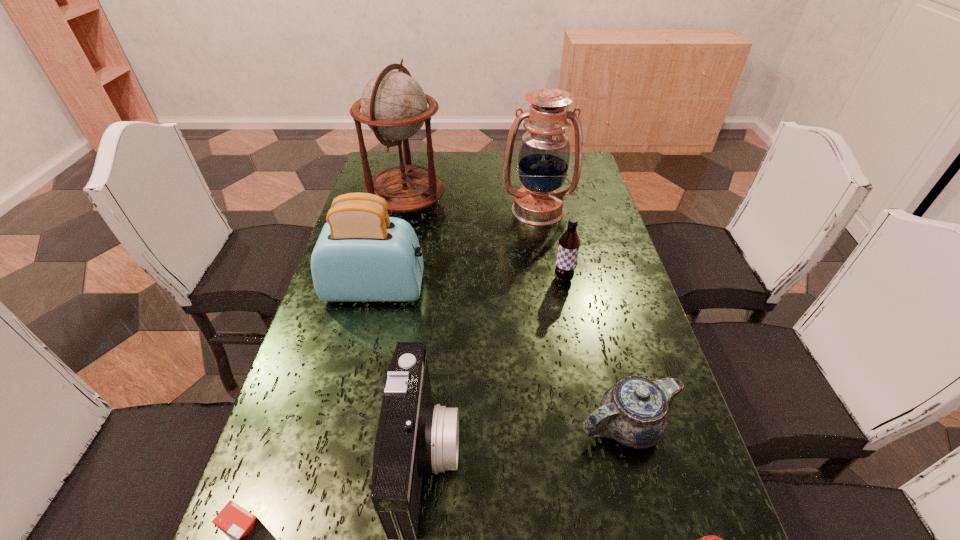
The height and width of the screenshot is (540, 960). Identify the location of vacant area that lies between the toaster and the chinaware. (501, 357).

At what (x,y) coordinates should I click in order to perform the action: click on free space that is in between the root beer and the toaster. Please return your answer as a coordinate pair (x, y). The width and height of the screenshot is (960, 540). Looking at the image, I should click on (469, 285).

Locate an element on the screen. This screenshot has height=540, width=960. free space between the chinaware and the oil lamp is located at coordinates (582, 318).

Image resolution: width=960 pixels, height=540 pixels. Find the location of `vacant area that lies between the chinaware and the root beer`. vacant area that lies between the chinaware and the root beer is located at coordinates (594, 353).

Identify the location of the closest object to the camcorder. (250, 539).

Locate which object is the third closest to the second tallest object. Please provide its 2D coordinates. Your answer should be formatted as a tuple, i.e. [(x, y)], where the tuple contains the x and y coordinates of a point satisfying the conditions above.

[(362, 255)]

Where is `free space that satisfies the following two spatial constraints: 1. on the surface of the globe; 2. on the right side of the root beer`? The image size is (960, 540). free space that satisfies the following two spatial constraints: 1. on the surface of the globe; 2. on the right side of the root beer is located at coordinates (391, 280).

Locate an element on the screen. This screenshot has height=540, width=960. free space that satisfies the following two spatial constraints: 1. on the surface of the root beer; 2. on the left side of the globe is located at coordinates (391, 280).

Locate an element on the screen. The height and width of the screenshot is (540, 960). vacant space that satisfies the following two spatial constraints: 1. on the surface of the second tallest object; 2. on the right side of the globe is located at coordinates (406, 210).